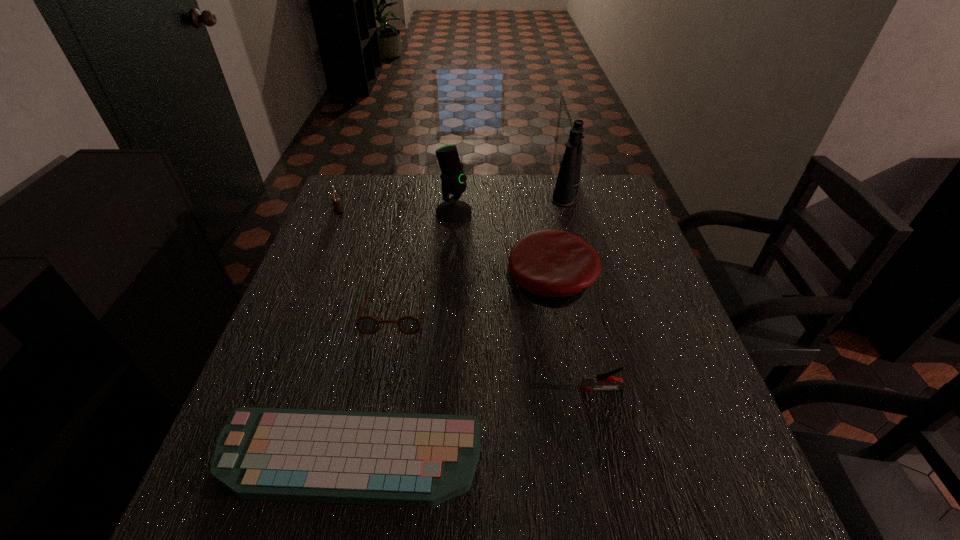
You are a GUI agent. You are given a task and a screenshot of the screen. Output one action in this format:
    pyautogui.click(x=<x>, y=<y>)
    Task: Click on the binoculars that is at the far edge
    
    Given the screenshot: What is the action you would take?
    pyautogui.click(x=568, y=178)

This screenshot has width=960, height=540. Identify the location of microphone that is positioned at the far edge. (453, 181).

Identify the location of padlock positioned at the far edge. (338, 209).

You are a GUI agent. You are given a task and a screenshot of the screen. Output one action in this format:
    pyautogui.click(x=<x>, y=<y>)
    Task: Click on the object that is at the near edge
    
    Given the screenshot: What is the action you would take?
    pyautogui.click(x=323, y=456)

This screenshot has height=540, width=960. Identify the location of padlock located in the left edge section of the desktop. (338, 209).

I want to click on computer keyboard that is at the left edge, so click(x=323, y=456).

Where is `object present at the right edge`? This screenshot has width=960, height=540. object present at the right edge is located at coordinates (568, 178).

Where is `object at the far left corner`? The width and height of the screenshot is (960, 540). object at the far left corner is located at coordinates (338, 209).

The width and height of the screenshot is (960, 540). I want to click on object that is at the near left corner, so click(x=323, y=456).

I want to click on object at the far right corner, so click(x=568, y=178).